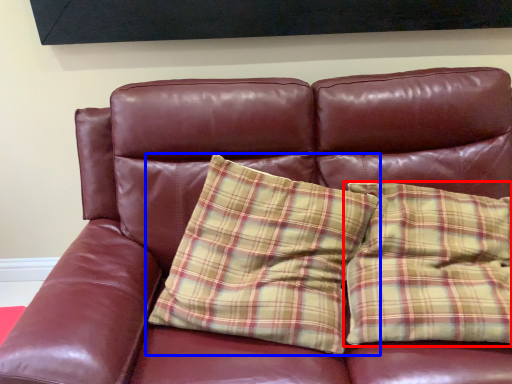
Question: Among these objects, which one is farthest to the camera, pillow (highlighted by a red box) or pillow (highlighted by a blue box)?

Choices:
 (A) pillow
 (B) pillow

Answer: (B)